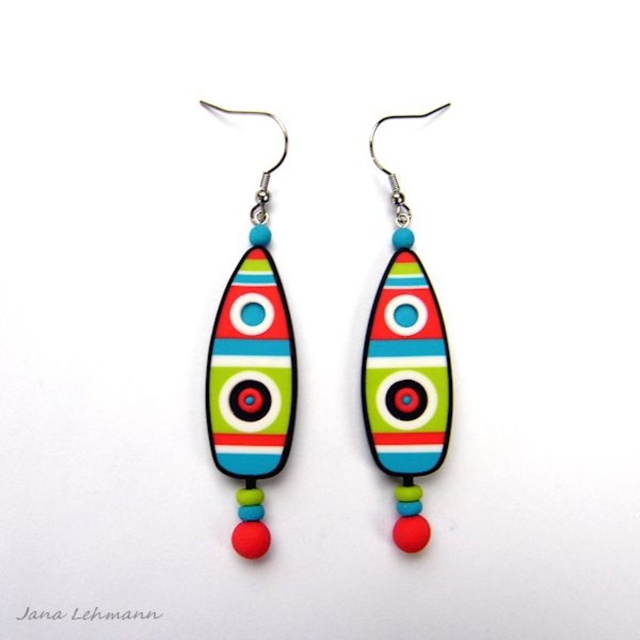
Measure the distance between matte plastic earring at left and camera.

They are 4.31 feet apart.

Is matte plastic earring at left further to camera compared to matte plastic earring at center?

No, matte plastic earring at left is closer to the viewer.

Which is in front, point (257, 472) or point (429, 419)?

Point (257, 472) is more forward.

Identify the location of matte plastic earring at left. (252, 369).